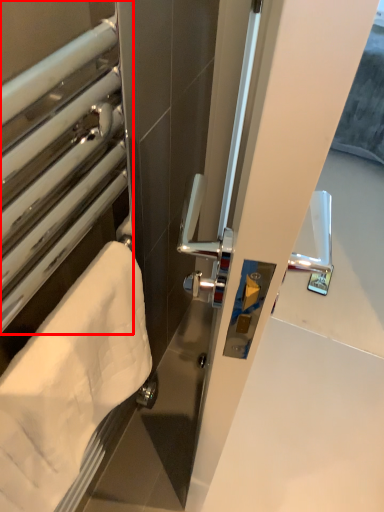
Question: In this image, where is window (annotated by the red box) located relative to towel?

Choices:
 (A) left
 (B) right

Answer: (A)